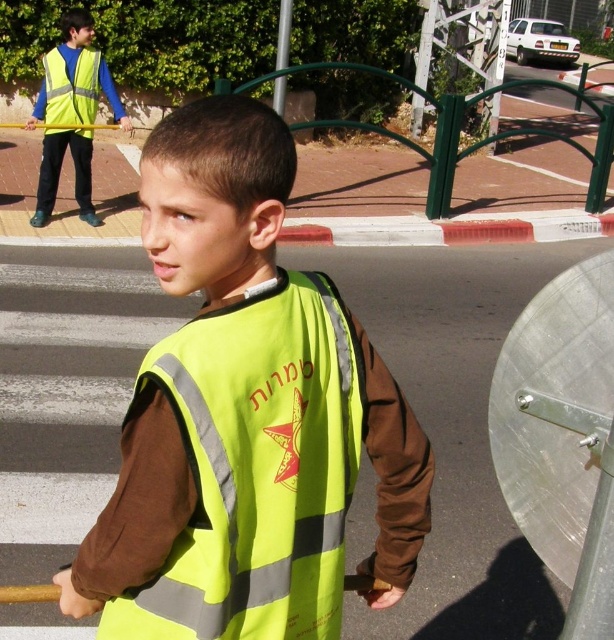
Can you confirm if high-visibility fabric safety vest at center is positioned to the right of reflective yellow safety vest at upper left?

Indeed, high-visibility fabric safety vest at center is positioned on the right side of reflective yellow safety vest at upper left.

Is point (187, 560) positioned before point (82, 49)?

Yes, it is.

What do you see at coordinates (255, 468) in the screenshot? This screenshot has height=640, width=614. I see `high-visibility fabric safety vest at center` at bounding box center [255, 468].

Locate an element on the screen. The height and width of the screenshot is (640, 614). high-visibility fabric safety vest at center is located at coordinates (255, 468).

Who is higher up, high-visibility fabric safety vest at center or high-visibility fabric vest at upper left?

high-visibility fabric vest at upper left

Can you confirm if high-visibility fabric safety vest at center is positioned to the right of high-visibility fabric vest at upper left?

Indeed, high-visibility fabric safety vest at center is positioned on the right side of high-visibility fabric vest at upper left.

Who is more distant from viewer, (293, 387) or (117, 99)?

The point (117, 99) is more distant.

Locate an element on the screen. The image size is (614, 640). high-visibility fabric safety vest at center is located at coordinates (255, 468).

Who is lower down, high-visibility fabric vest at upper left or reflective yellow safety vest at upper left?

high-visibility fabric vest at upper left is below.

Is point (79, 131) behind point (87, 106)?

That is True.

At what (x,y) coordinates should I click in order to perform the action: click on high-visibility fabric vest at upper left. Please return your answer as a coordinate pair (x, y). Looking at the image, I should click on (76, 77).